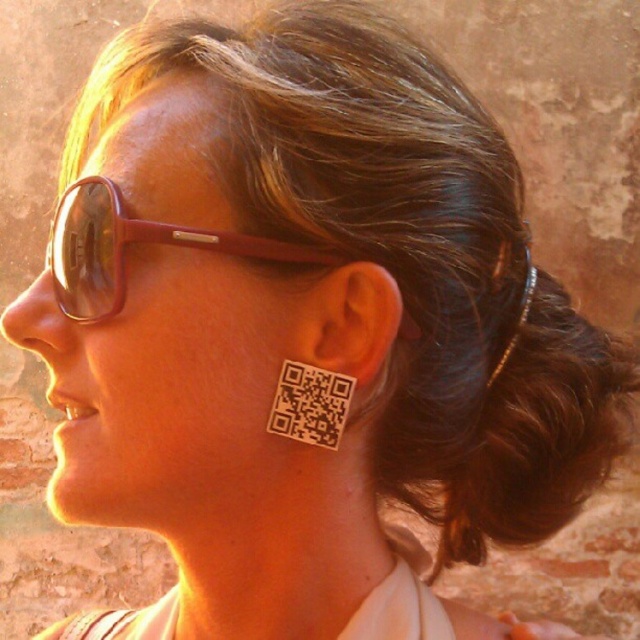
You are designing a poster and need to know the relative sizes of the objects in the image. Which object is taller between the matte brown goggles at upper left and the white matte qr code at ear?

The matte brown goggles at upper left has a greater height compared to the white matte qr code at ear, so the matte brown goggles at upper left is taller.

Based on the photo, you are a photographer adjusting your camera settings. You notice two items in the frame that might distract from the subject. The matte brown goggles at upper left and the white matte qr code at ear. Which of these items is bigger and might need to be cropped out for a cleaner composition?

The matte brown goggles at upper left is larger in size than the white matte qr code at ear, so it might need to be cropped out for a cleaner composition.

You are a photographer standing 16 inches away from the matte brown goggles at upper left. Can you capture the entire image of the goggles in your camera frame without moving closer or farther?

The matte brown goggles at upper left and viewer are 15.85 inches apart from each other, so you are standing slightly farther away than the required distance. To capture the entire image without moving, adjust your camera settings or use a wider lens.